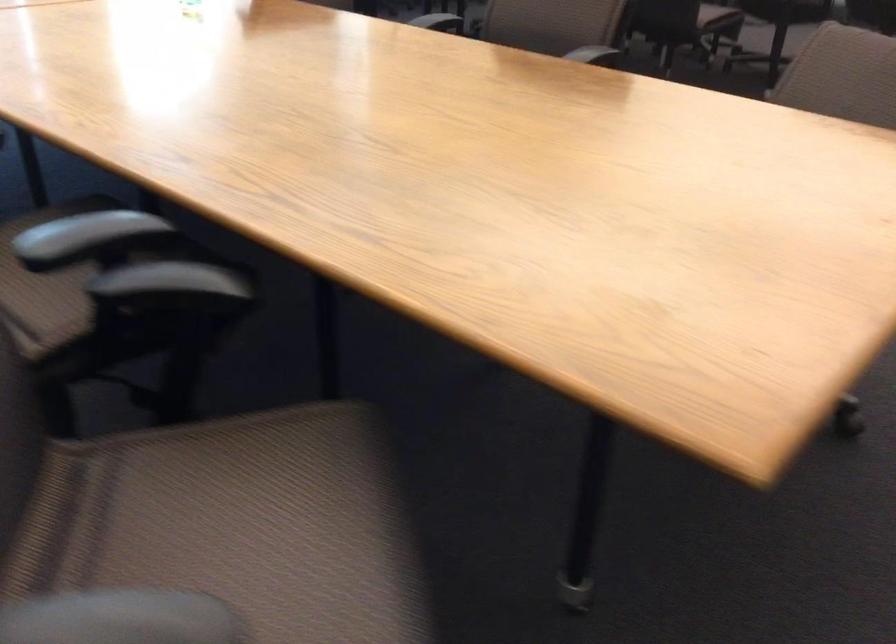
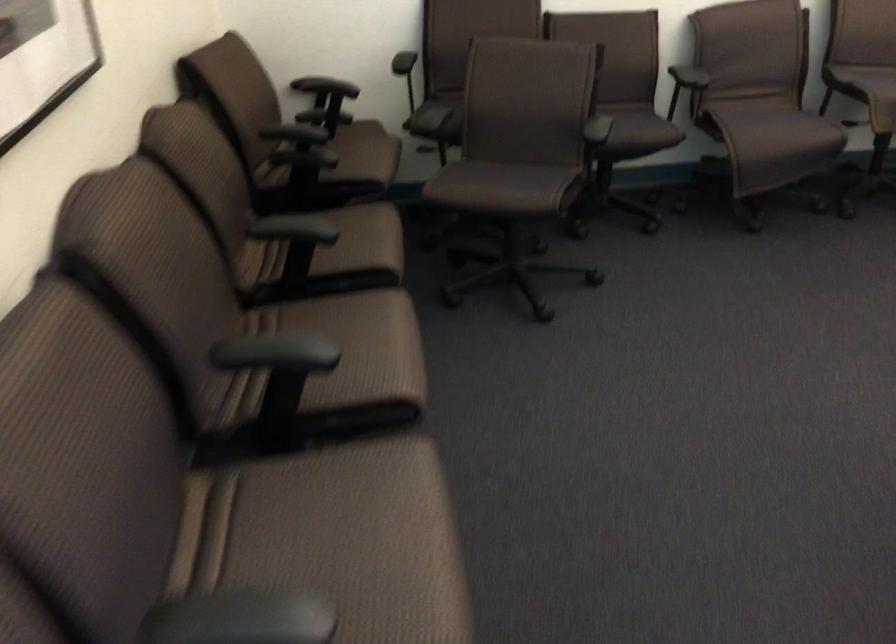
How did the camera likely rotate?

The rotation direction of the camera is right-down.